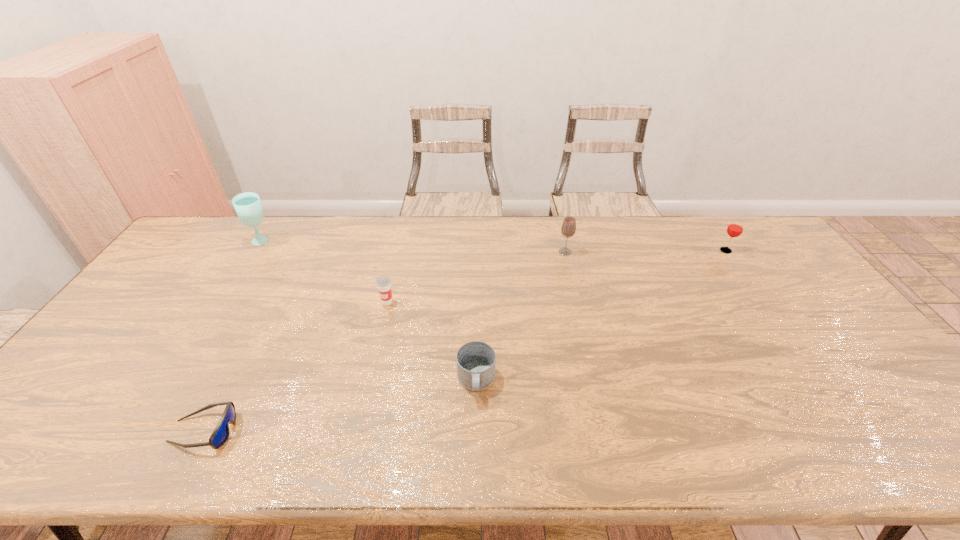
Locate an element on the screen. This screenshot has width=960, height=540. the tallest object is located at coordinates (248, 207).

Find the location of a particular element. the leftmost object is located at coordinates (248, 207).

I want to click on the fifth object from left to right, so click(x=568, y=229).

This screenshot has height=540, width=960. What are the coordinates of `the rightmost object` in the screenshot? It's located at (735, 228).

Locate an element on the screen. The image size is (960, 540). the fourth object from right to left is located at coordinates (383, 283).

Locate an element on the screen. The image size is (960, 540). the third nearest object is located at coordinates pos(383,283).

Where is `the fifth tallest object`? The height and width of the screenshot is (540, 960). the fifth tallest object is located at coordinates (476, 360).

At what (x,y) coordinates should I click in order to perform the action: click on mug. Please return your answer as a coordinate pair (x, y). This screenshot has width=960, height=540. Looking at the image, I should click on (476, 360).

Where is `sunglasses`? The width and height of the screenshot is (960, 540). sunglasses is located at coordinates (220, 434).

Locate an element on the screen. The width and height of the screenshot is (960, 540). the second object from left to right is located at coordinates (220, 434).